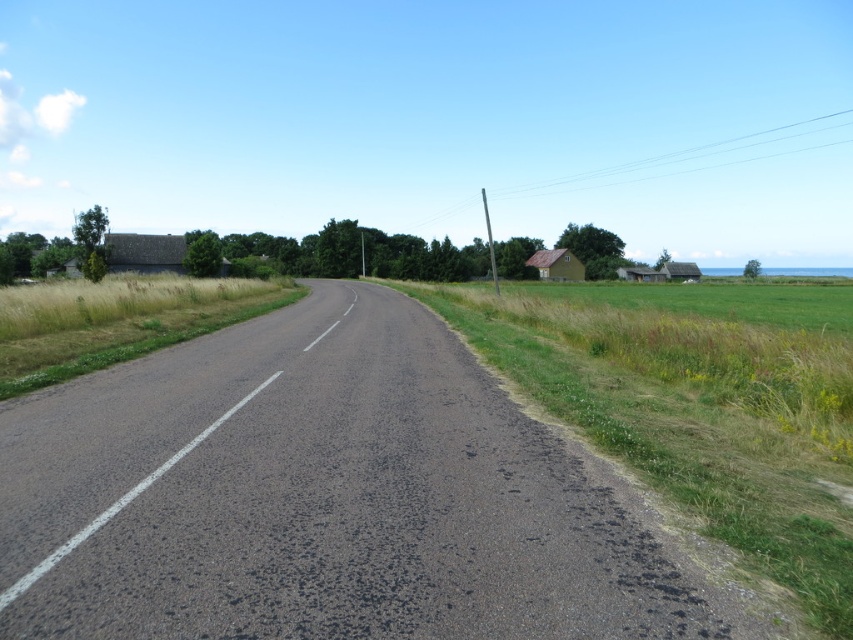
Question: Where is green grass at center located in relation to green grass at left in the image?

Choices:
 (A) above
 (B) below

Answer: (B)

Question: Is green grass at center wider than green grass at left?

Choices:
 (A) yes
 (B) no

Answer: (B)

Question: Which point appears closest to the camera in this image?

Choices:
 (A) (x=827, y=337)
 (B) (x=61, y=349)

Answer: (A)

Question: Can you confirm if green grass at center is positioned above green grass at left?

Choices:
 (A) no
 (B) yes

Answer: (A)